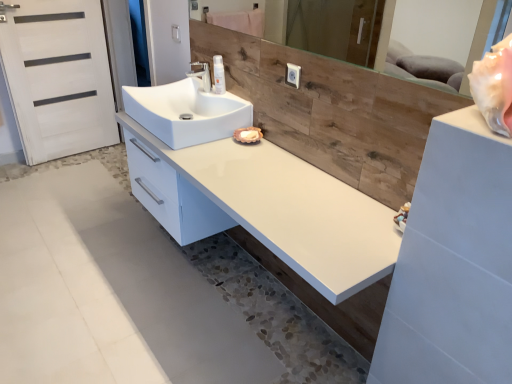
I want to click on blank area beneath white glossy counter at center (from a real-world perspective), so click(255, 326).